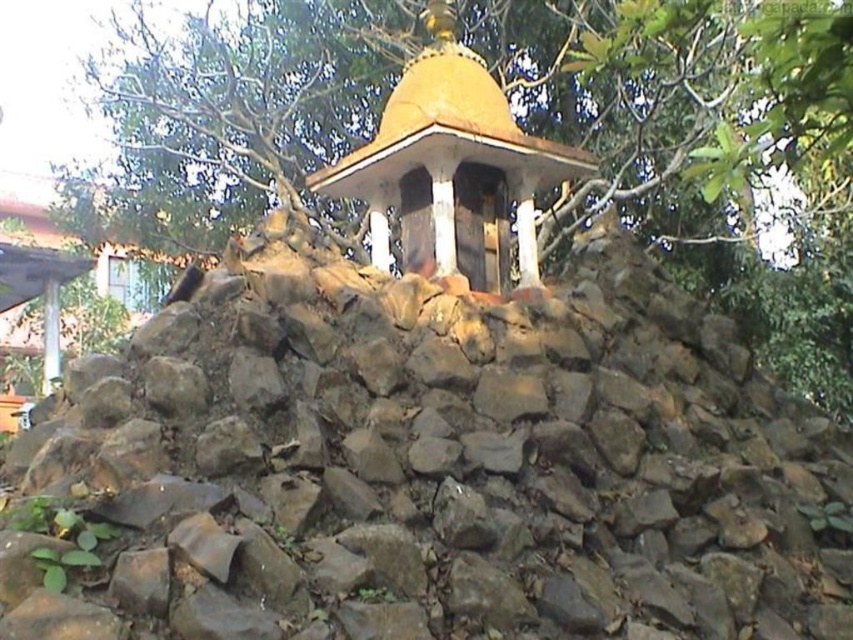
Based on the photo, which is more to the right, brown rough stone at center or green leafy tree at upper center?

brown rough stone at center

Who is more distant from viewer, (677, 524) or (712, 212)?

The point (712, 212) is more distant.

You are a GUI agent. You are given a task and a screenshot of the screen. Output one action in this format:
    pyautogui.click(x=<x>, y=<y>)
    Task: Click on the brown rough stone at center
    
    Given the screenshot: What is the action you would take?
    pyautogui.click(x=430, y=467)

Where is `brown rough stone at center`? brown rough stone at center is located at coordinates (430, 467).